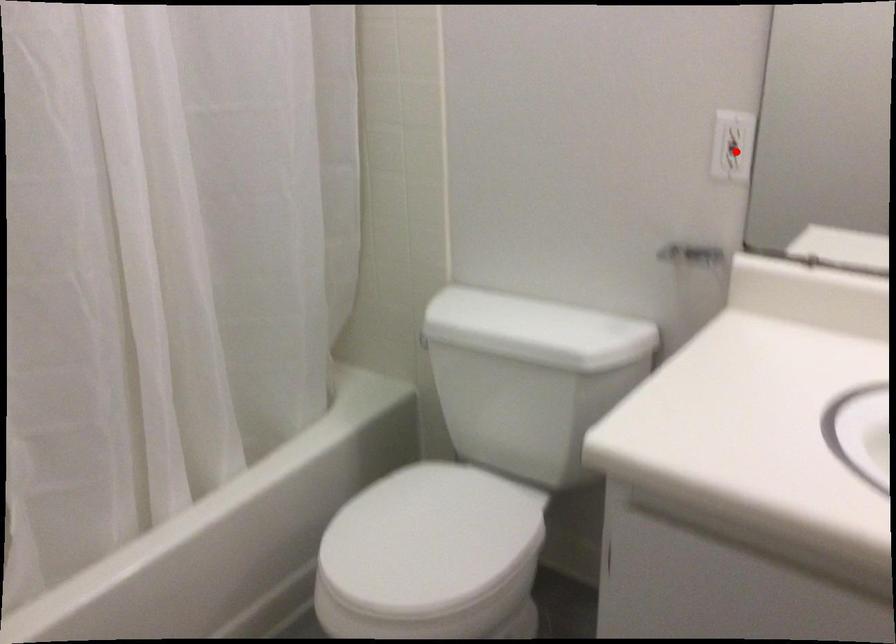
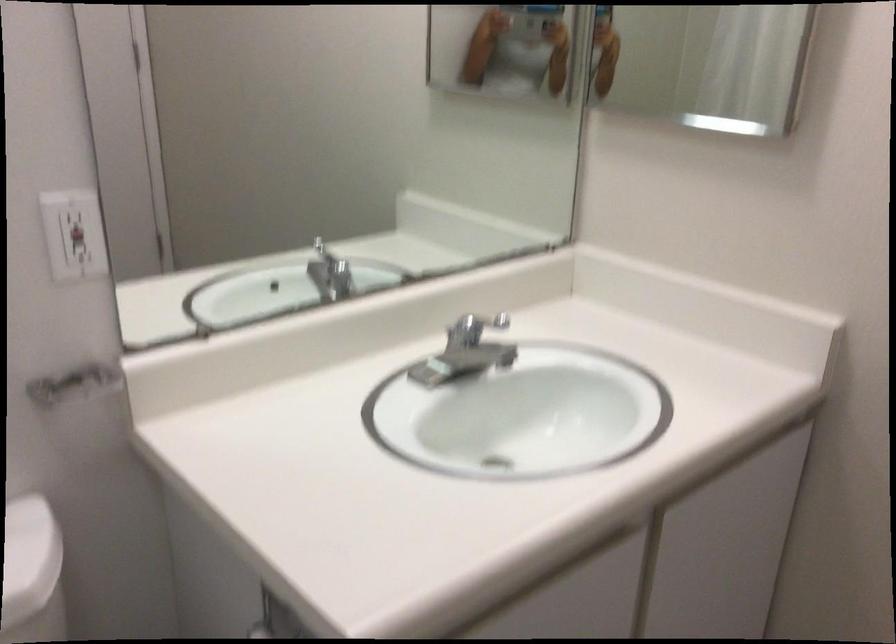
Question: I am providing you with two images of the same scene from different viewpoints. Given a red point in image1, look at the same physical point in image2. Is it:

Choices:
 (A) Closer to the viewpoint
 (B) Farther from the viewpoint

Answer: (A)